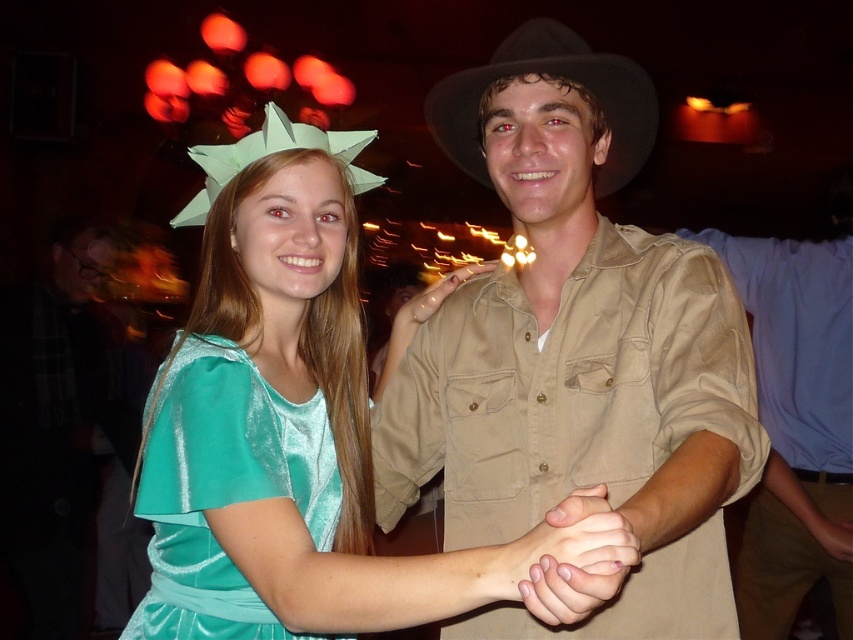
Question: Does shiny teal dress at center have a smaller size compared to black felt fedora at center?

Choices:
 (A) yes
 (B) no

Answer: (B)

Question: Considering the relative positions of satin tan shirt at center and black felt fedora at center in the image provided, where is satin tan shirt at center located with respect to black felt fedora at center?

Choices:
 (A) above
 (B) below

Answer: (B)

Question: Which point is farther to the camera?

Choices:
 (A) (599, 504)
 (B) (712, 572)
 (C) (207, 529)
 (D) (585, 52)

Answer: (D)

Question: Is satin tan shirt at center wider than pale skin/soft flesh at center?

Choices:
 (A) no
 (B) yes

Answer: (B)

Question: Which object appears closest to the camera in this image?

Choices:
 (A) shiny teal dress at center
 (B) pale skin/soft flesh at center
 (C) black felt fedora at center

Answer: (B)

Question: Among these points, which one is farthest from the camera?

Choices:
 (A) (619, 525)
 (B) (164, 522)
 (C) (642, 156)
 (D) (503, 285)

Answer: (C)